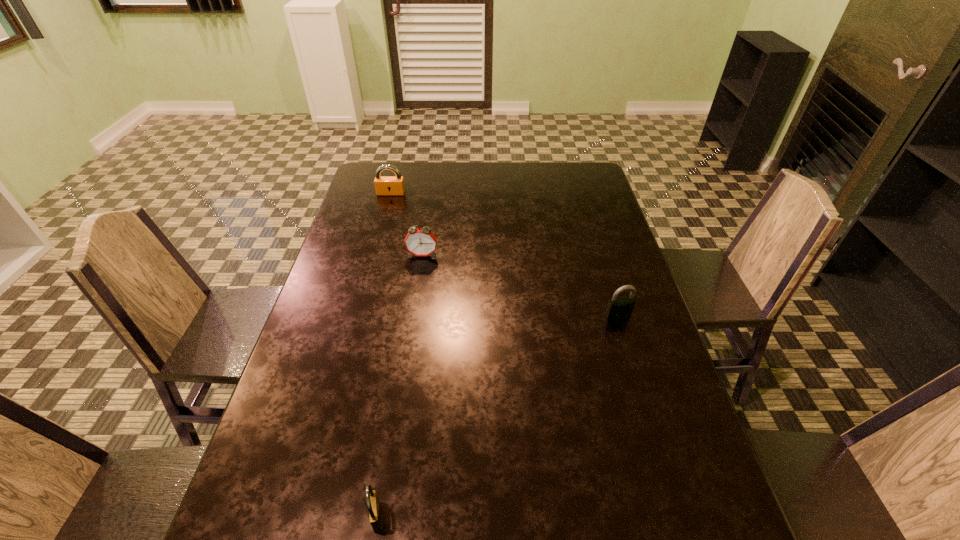
Locate which object is the closest to the third nearest object. Please provide its 2D coordinates. Your answer should be formatted as a tuple, i.e. [(x, y)], where the tuple contains the x and y coordinates of a point satisfying the conditions above.

[(384, 185)]

The image size is (960, 540). What are the coordinates of `padlock that is the closest to the alarm clock` in the screenshot? It's located at (384, 185).

Find the location of `the second closest padlock to the farthest object`. the second closest padlock to the farthest object is located at coordinates (374, 510).

The image size is (960, 540). Find the location of `blank area in the image that satisfies the following two spatial constraints: 1. on the back side of the second padlock from left to right; 2. on the left side of the third farthest object`. blank area in the image that satisfies the following two spatial constraints: 1. on the back side of the second padlock from left to right; 2. on the left side of the third farthest object is located at coordinates (409, 316).

At what (x,y) coordinates should I click in order to perform the action: click on free location that satisfies the following two spatial constraints: 1. on the back side of the second farthest padlock; 2. on the right side of the nearest object. Please return your answer as a coordinate pair (x, y). This screenshot has width=960, height=540. Looking at the image, I should click on (409, 316).

The image size is (960, 540). In order to click on blank area in the image that satisfies the following two spatial constraints: 1. to unlock the nearest object from the front; 2. on the left side of the farthest padlock in this screenshot , I will do `click(303, 517)`.

You are a GUI agent. You are given a task and a screenshot of the screen. Output one action in this format:
    pyautogui.click(x=<x>, y=<y>)
    Task: Click on the vacant point that satisfies the following two spatial constraints: 1. to unlock the farthest padlock from the front; 2. on the left side of the nearest padlock
    The image size is (960, 540).
    Given the screenshot: What is the action you would take?
    pyautogui.click(x=303, y=517)

At what (x,y) coordinates should I click in order to perform the action: click on vacant area in the image that satisfies the following two spatial constraints: 1. on the clock face of the alarm clock; 2. on the left side of the second nearest padlock. Please return your answer as a coordinate pair (x, y). Image resolution: width=960 pixels, height=540 pixels. Looking at the image, I should click on (414, 316).

Find the location of `free space that satisfies the following two spatial constraints: 1. on the clock face of the third farthest object; 2. on the left side of the alarm clock`. free space that satisfies the following two spatial constraints: 1. on the clock face of the third farthest object; 2. on the left side of the alarm clock is located at coordinates (414, 316).

Where is `free location that satisfies the following two spatial constraints: 1. on the clock face of the third nearest object; 2. on the left side of the rightmost object`? free location that satisfies the following two spatial constraints: 1. on the clock face of the third nearest object; 2. on the left side of the rightmost object is located at coordinates (414, 316).